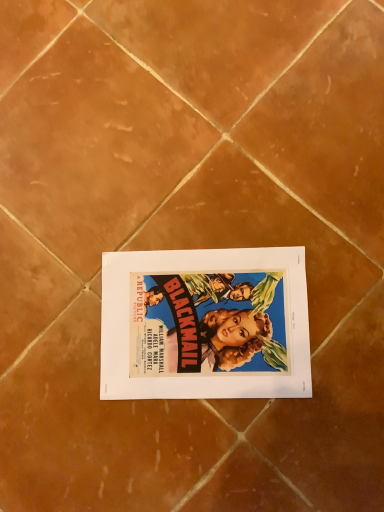
Question: Should I look upward or downward to see vibrant paper poster at center?

Choices:
 (A) down
 (B) up

Answer: (A)